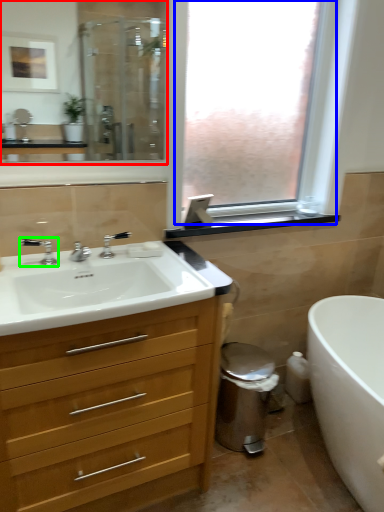
Question: Which is farther away from mirror (highlighted by a red box)? window (highlighted by a blue box) or tap (highlighted by a green box)?

Choices:
 (A) window
 (B) tap

Answer: (B)